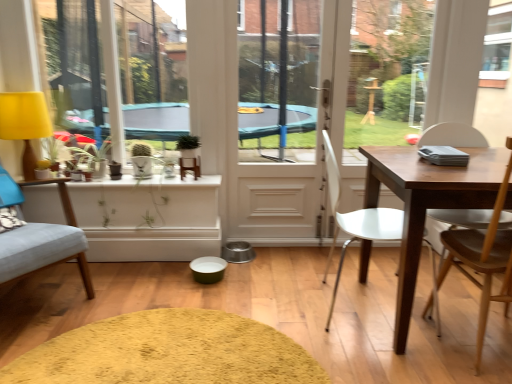
Image resolution: width=512 pixels, height=384 pixels. Find the location of `unoccupied area behind soft yellow rug at center`. unoccupied area behind soft yellow rug at center is located at coordinates (194, 280).